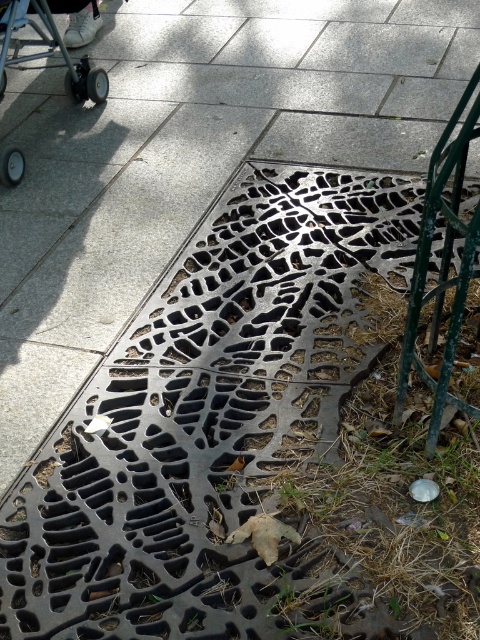
Does point (400, 385) come farther from viewer compared to point (26, 40)?

No, (400, 385) is closer to viewer.

The height and width of the screenshot is (640, 480). What do you see at coordinates (442, 266) in the screenshot?
I see `green metal rail at right` at bounding box center [442, 266].

Who is more forward, (448,342) or (73,10)?

Positioned in front is point (448,342).

Identify the location of green metal rail at right. (442, 266).